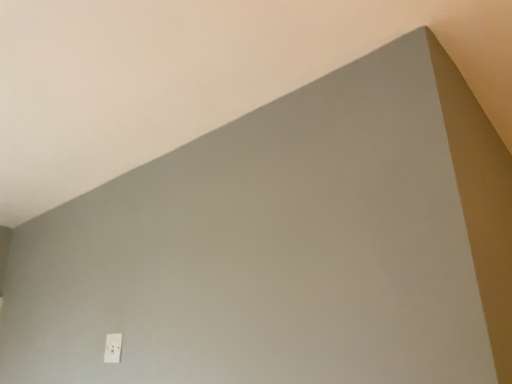
What do you see at coordinates (113, 348) in the screenshot? I see `white plastic electric outlet at lower left` at bounding box center [113, 348].

Consider the image. What is the approximate width of white plastic electric outlet at lower left?

white plastic electric outlet at lower left is 0.40 inches in width.

Where is `white plastic electric outlet at lower left`? This screenshot has height=384, width=512. white plastic electric outlet at lower left is located at coordinates (113, 348).

This screenshot has width=512, height=384. Identify the location of white plastic electric outlet at lower left. (113, 348).